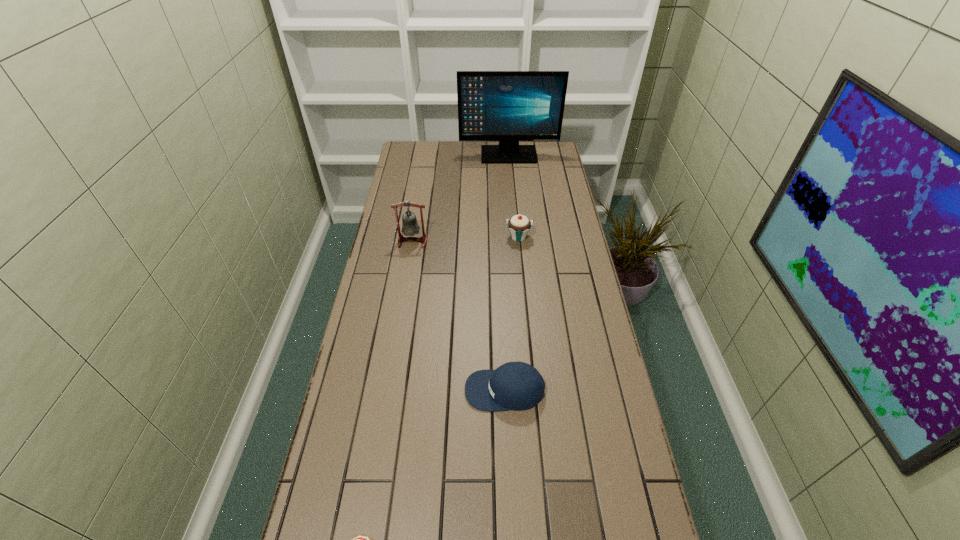
Where is `free location that satisfies the following two spatial constraints: 1. on the screen side of the tallest object; 2. on the front-facing side of the baseball cap`? The image size is (960, 540). free location that satisfies the following two spatial constraints: 1. on the screen side of the tallest object; 2. on the front-facing side of the baseball cap is located at coordinates (530, 390).

Find the location of `free spot that satisfies the following two spatial constraints: 1. on the screen side of the farthest object; 2. on the front-facing side of the second nearest object`. free spot that satisfies the following two spatial constraints: 1. on the screen side of the farthest object; 2. on the front-facing side of the second nearest object is located at coordinates (530, 390).